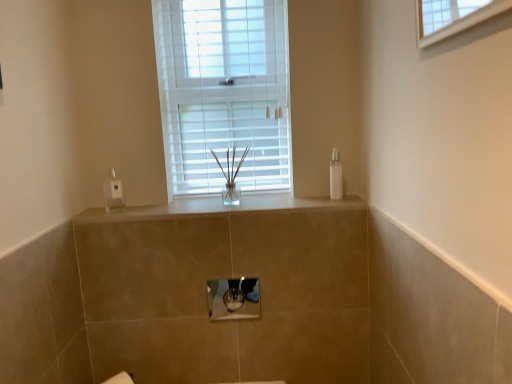
Question: In terms of height, does clear plastic soap dispenser at left look taller or shorter compared to metallic silver medicine cabinet at center?

Choices:
 (A) tall
 (B) short

Answer: (A)

Question: Considering the positions of clear plastic soap dispenser at left and metallic silver medicine cabinet at center in the image, is clear plastic soap dispenser at left wider or thinner than metallic silver medicine cabinet at center?

Choices:
 (A) wide
 (B) thin

Answer: (A)

Question: Estimate the real-world distances between objects in this image. Which object is farther from the satin beige countertop at center?

Choices:
 (A) clear plastic soap dispenser at left
 (B) white plastic window at center
 (C) clear plastic bottle at right
 (D) metallic silver medicine cabinet at center

Answer: (B)

Question: Estimate the real-world distances between objects in this image. Which object is farther from the clear plastic soap dispenser at left?

Choices:
 (A) metallic silver medicine cabinet at center
 (B) satin beige countertop at center
 (C) white plastic window at center
 (D) clear plastic bottle at right

Answer: (D)